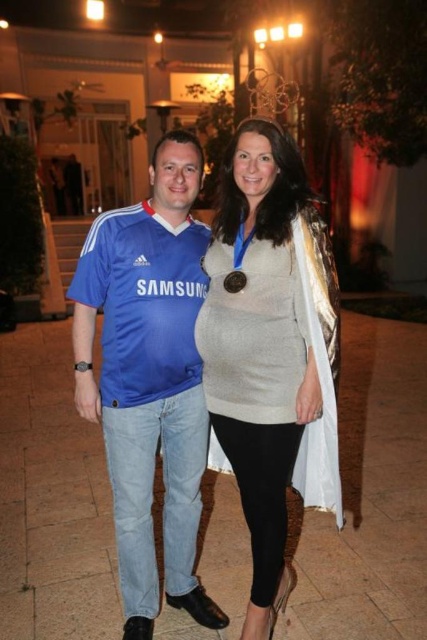
Can you confirm if matte gray sweater at center is smaller than gold metallic medal at center?

No, matte gray sweater at center is not smaller than gold metallic medal at center.

Is matte gray sweater at center to the left of gold metallic medal at center from the viewer's perspective?

No, matte gray sweater at center is not to the left of gold metallic medal at center.

What do you see at coordinates (269, 346) in the screenshot? This screenshot has height=640, width=427. I see `matte gray sweater at center` at bounding box center [269, 346].

Where is `matte gray sweater at center`? The image size is (427, 640). matte gray sweater at center is located at coordinates pyautogui.click(x=269, y=346).

Can you confirm if blue jersey at center is taller than gold metallic medal at center?

Yes, blue jersey at center is taller than gold metallic medal at center.

Is blue jersey at center smaller than gold metallic medal at center?

Actually, blue jersey at center might be larger than gold metallic medal at center.

Measure the distance between point (173, 330) and camera.

A distance of 7.70 feet exists between point (173, 330) and camera.

Where is `blue jersey at center`? The image size is (427, 640). blue jersey at center is located at coordinates (149, 378).

Who is more distant from viewer, (211, 609) or (310, 337)?

Point (211, 609)

Can you confirm if blue jersey at center is wider than matte gray sweater at center?

Indeed, blue jersey at center has a greater width compared to matte gray sweater at center.

The height and width of the screenshot is (640, 427). What are the coordinates of `blue jersey at center` in the screenshot? It's located at (149, 378).

Locate an element on the screen. The width and height of the screenshot is (427, 640). blue jersey at center is located at coordinates (149, 378).